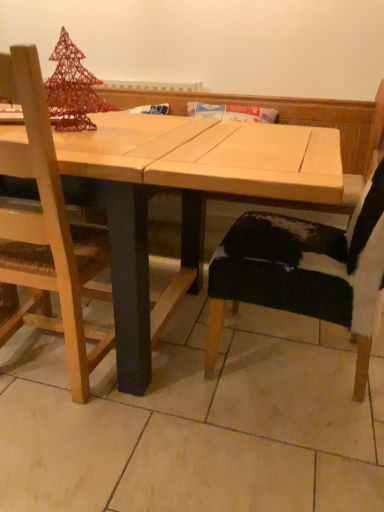
Where is `free location in front of wooden chair at left, marked as the 1th chair in a left-to-right arrangement`? The height and width of the screenshot is (512, 384). free location in front of wooden chair at left, marked as the 1th chair in a left-to-right arrangement is located at coordinates (69, 448).